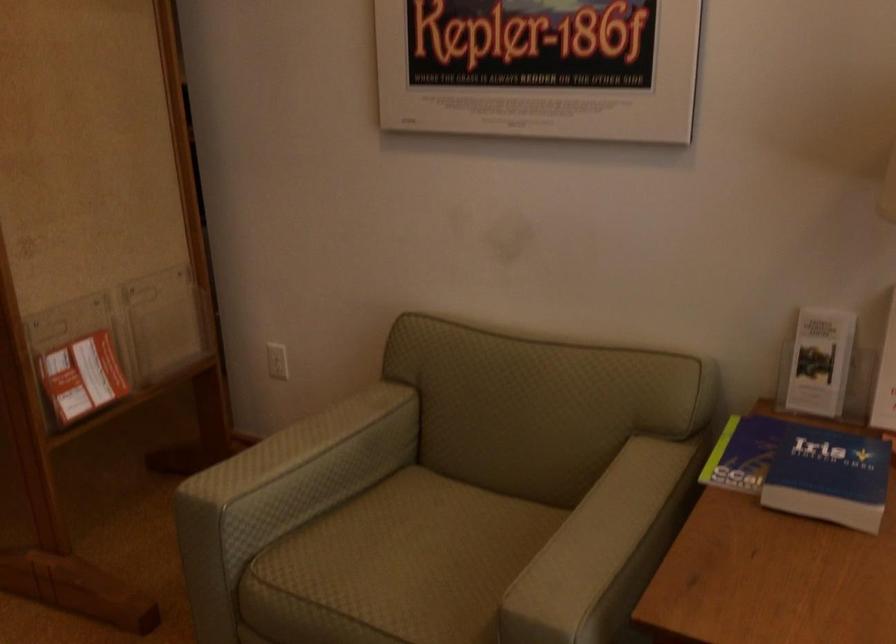
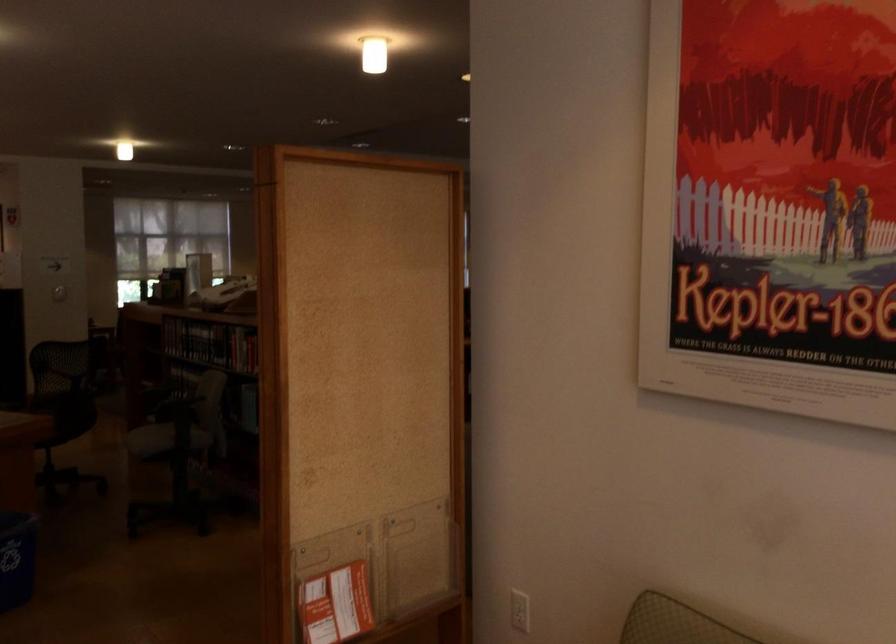
Question: The images are taken continuously from a first-person perspective. In which direction are you moving?

Choices:
 (A) Left
 (B) Right
 (C) Forward
 (D) Backward

Answer: (B)